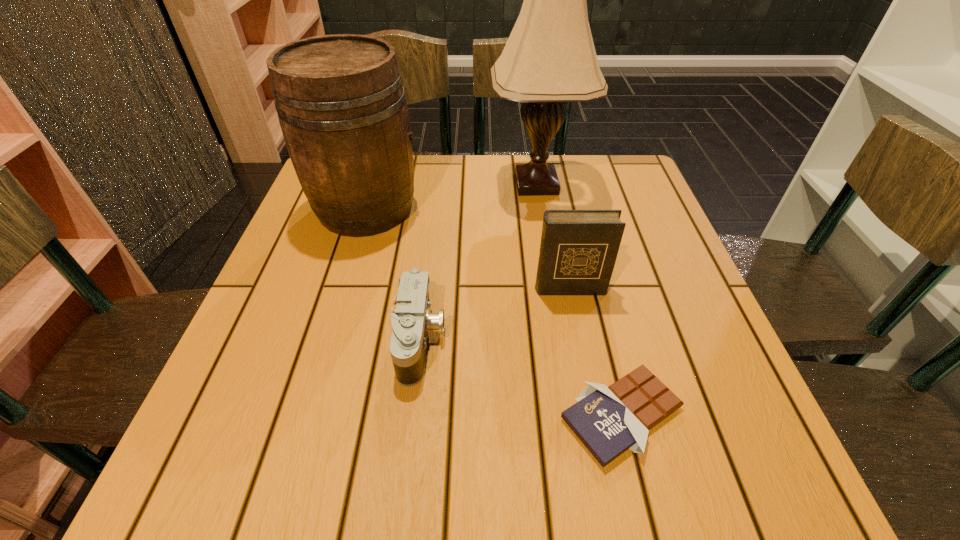
The width and height of the screenshot is (960, 540). In order to click on vacant space located on the left of the shortest object in this screenshot , I will do `click(412, 415)`.

Locate an element on the screen. lamp present at the far edge is located at coordinates (549, 59).

The height and width of the screenshot is (540, 960). Identify the location of cider that is positioned at the far edge. (340, 100).

Where is `object that is at the near edge`? This screenshot has width=960, height=540. object that is at the near edge is located at coordinates (609, 420).

You are a GUI agent. You are given a task and a screenshot of the screen. Output one action in this format:
    pyautogui.click(x=<x>, y=<y>)
    Task: Click on the object that is at the left edge
    
    Given the screenshot: What is the action you would take?
    pyautogui.click(x=340, y=100)

This screenshot has width=960, height=540. Find the location of `lamp positioned at the right edge`. lamp positioned at the right edge is located at coordinates (549, 59).

Where is `chocolate bar present at the right edge`? The height and width of the screenshot is (540, 960). chocolate bar present at the right edge is located at coordinates (609, 420).

Identify the location of object that is at the far left corner. This screenshot has height=540, width=960. (340, 100).

Identify the location of object that is at the far right corner. (549, 59).

You are a GUI agent. You are given a task and a screenshot of the screen. Output one action in this format:
    pyautogui.click(x=<x>, y=<y>)
    Task: Click on the object at the near right corner
    
    Given the screenshot: What is the action you would take?
    pyautogui.click(x=609, y=420)